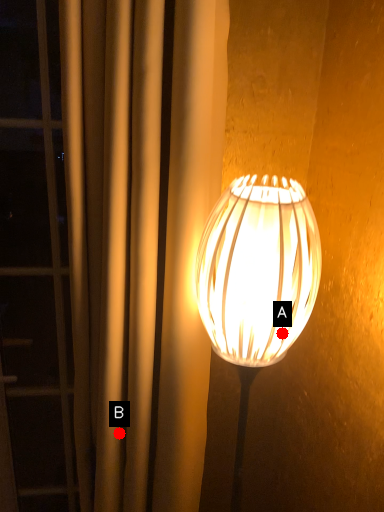
Question: Two points are circled on the image, labeled by A and B beside each circle. Which of the following is the farthest from the observer?

Choices:
 (A) A is further
 (B) B is further

Answer: (B)